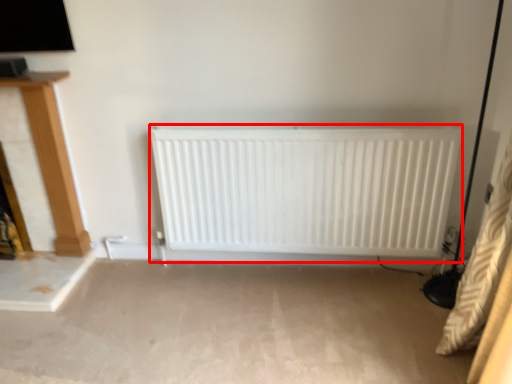
Question: Considering the relative positions of radiator (annotated by the red box) and furniture in the image provided, where is radiator (annotated by the red box) located with respect to the staircase?

Choices:
 (A) left
 (B) right

Answer: (B)